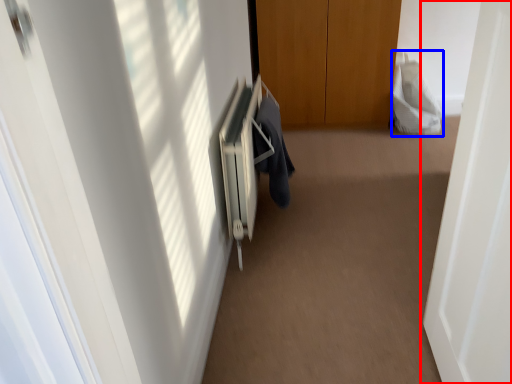
Question: Which point is further to the camera, door (highlighted by a red box) or robe (highlighted by a blue box)?

Choices:
 (A) door
 (B) robe

Answer: (B)